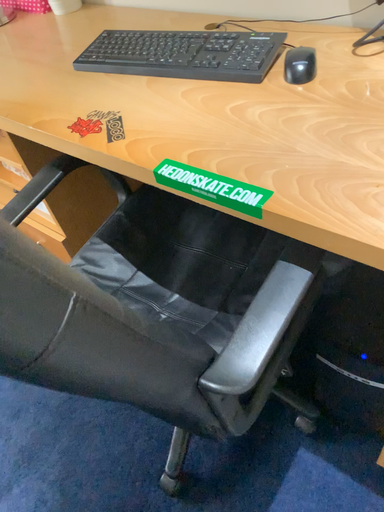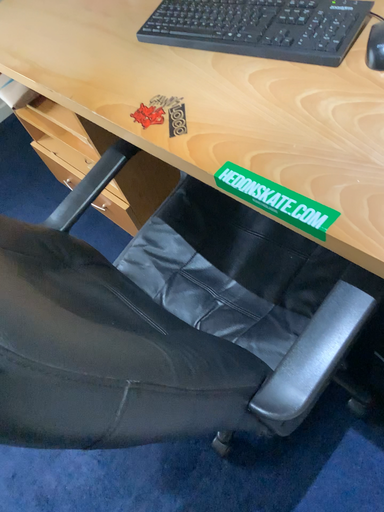
Question: How did the camera likely rotate when shooting the video?

Choices:
 (A) rotated downward
 (B) rotated upward

Answer: (A)